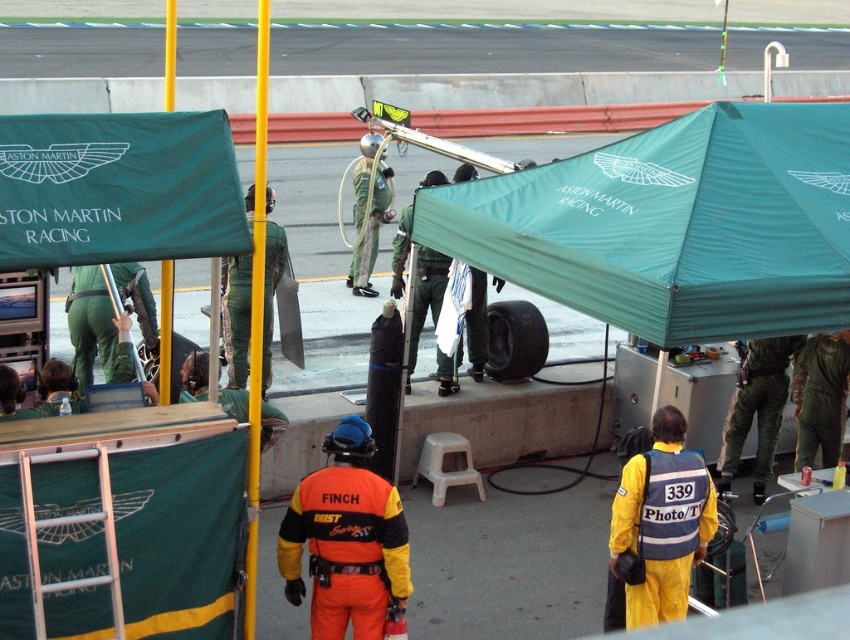
Based on the photo, how far apart are orange fabric safety vest at center and yellow reflective vest at center?

1.60 meters

Which of these two, orange fabric safety vest at center or yellow reflective vest at center, stands shorter?

Standing shorter between the two is yellow reflective vest at center.

Does point (367, 602) come closer to viewer compared to point (646, 465)?

Yes, point (367, 602) is in front of point (646, 465).

Find the location of a particular element. The height and width of the screenshot is (640, 850). orange fabric safety vest at center is located at coordinates (346, 540).

This screenshot has width=850, height=640. Describe the element at coordinates (672, 502) in the screenshot. I see `yellow reflective vest at center` at that location.

Does point (667, 518) come in front of point (361, 248)?

Yes, it is in front of point (361, 248).

This screenshot has width=850, height=640. In order to click on yellow reflective vest at center in this screenshot , I will do `click(672, 502)`.

Does green fabric canopy at upper center have a smaller size compared to yellow reflective vest at center?

No.

Who is positioned more to the right, green fabric canopy at upper center or yellow reflective vest at center?

Positioned to the right is green fabric canopy at upper center.

What do you see at coordinates (673, 225) in the screenshot? I see `green fabric canopy at upper center` at bounding box center [673, 225].

Where is `green fabric canopy at upper center`? This screenshot has height=640, width=850. green fabric canopy at upper center is located at coordinates (673, 225).